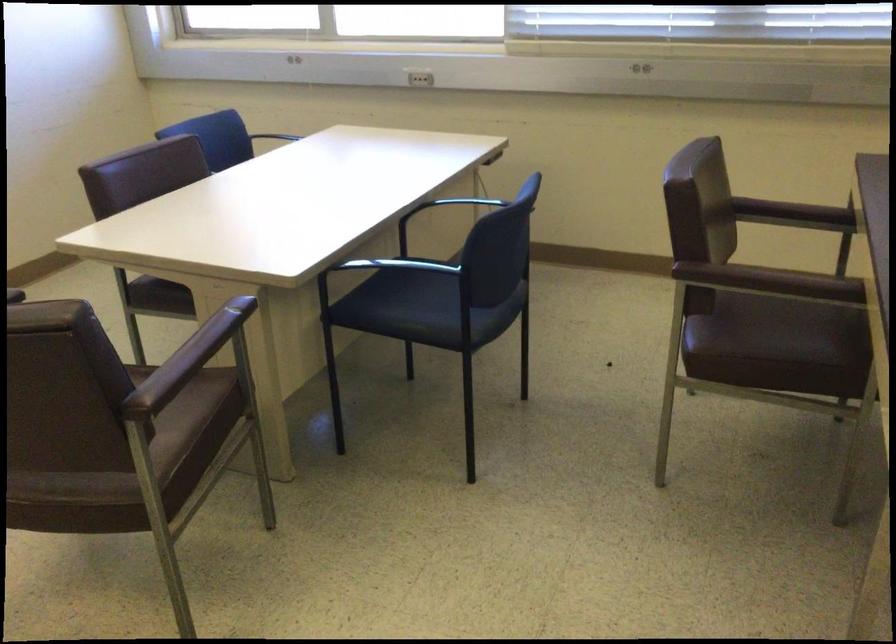
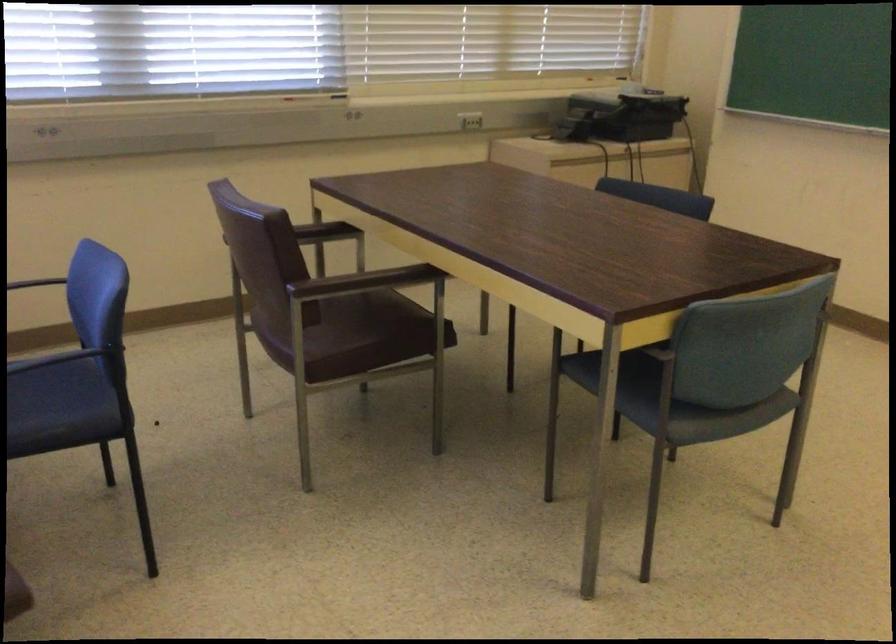
Question: I am providing you with two images of the same scene from different viewpoints. Please identify which objects are invisible in image2.

Choices:
 (A) black chair armrest
 (B) dark blue sitting surface
 (C) brown chair sitting surface
 (D) none of these

Answer: (D)